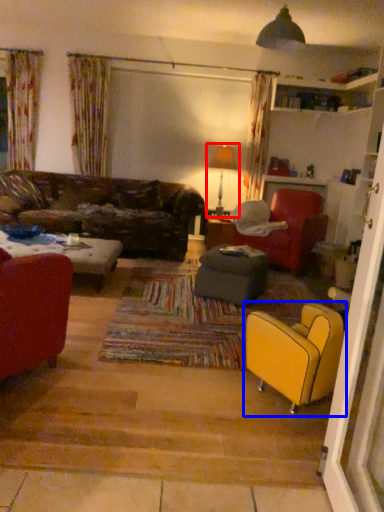
Question: Which object is closer to the camera taking this photo, lamp (highlighted by a red box) or chair (highlighted by a blue box)?

Choices:
 (A) lamp
 (B) chair

Answer: (B)